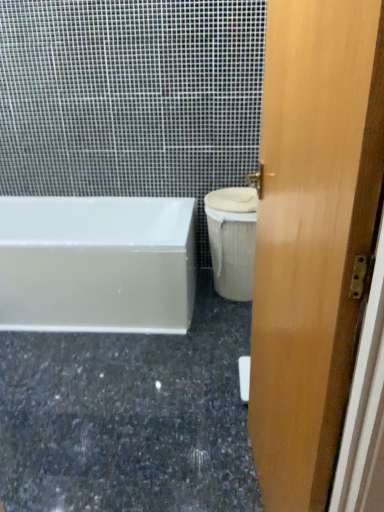
The height and width of the screenshot is (512, 384). Describe the element at coordinates (312, 234) in the screenshot. I see `light brown wood door at right` at that location.

What do you see at coordinates (232, 240) in the screenshot?
I see `white fabric-covered toilet bowl at right` at bounding box center [232, 240].

Image resolution: width=384 pixels, height=512 pixels. In order to click on light brown wood door at right in this screenshot , I will do `click(312, 234)`.

Considering the sizes of objects granite at lower left and white glossy bathtub at left in the image provided, who is wider, granite at lower left or white glossy bathtub at left?

granite at lower left.

Can you see granite at lower left touching white glossy bathtub at left?

No, granite at lower left is not beside white glossy bathtub at left.

Is granite at lower left inside or outside of white glossy bathtub at left?

granite at lower left is not enclosed by white glossy bathtub at left.

Which is closer to the camera, (x=10, y=419) or (x=116, y=320)?

Point (x=10, y=419) is positioned closer to the camera compared to point (x=116, y=320).

From a real-world perspective, is granite at lower left physically located above or below white fabric-covered toilet bowl at right?

granite at lower left is below white fabric-covered toilet bowl at right.

Is granite at lower left completely or partially outside of white fabric-covered toilet bowl at right?

Yes, granite at lower left is outside of white fabric-covered toilet bowl at right.

Does white glossy bathtub at left have a lesser height compared to light brown wood door at right?

Yes, white glossy bathtub at left is shorter than light brown wood door at right.

Is white glossy bathtub at left in front of light brown wood door at right?

That is False.

Looking at this image, considering the relative sizes of white glossy bathtub at left and light brown wood door at right in the image provided, is white glossy bathtub at left thinner than light brown wood door at right?

In fact, white glossy bathtub at left might be wider than light brown wood door at right.

What are the coordinates of `door on the right of white glossy bathtub at left` in the screenshot? It's located at (312, 234).

Where is `door below the white fabric-covered toilet bowl at right (from the image's perspective)`? The width and height of the screenshot is (384, 512). door below the white fabric-covered toilet bowl at right (from the image's perspective) is located at coordinates (312, 234).

In terms of size, does light brown wood door at right appear bigger or smaller than white fabric-covered toilet bowl at right?

In the image, light brown wood door at right appears to be larger than white fabric-covered toilet bowl at right.

Consider the image. Considering the positions of objects light brown wood door at right and white fabric-covered toilet bowl at right in the image provided, who is behind, light brown wood door at right or white fabric-covered toilet bowl at right?

white fabric-covered toilet bowl at right is behind.

Which is more to the right, light brown wood door at right or white fabric-covered toilet bowl at right?

light brown wood door at right.

At what (x,y) coordinates should I click in order to perform the action: click on bathtub behind the light brown wood door at right. Please return your answer as a coordinate pair (x, y). The height and width of the screenshot is (512, 384). Looking at the image, I should click on (97, 264).

Does light brown wood door at right have a greater width compared to white glossy bathtub at left?

No.

Is light brown wood door at right to the left or to the right of white glossy bathtub at left in the image?

Clearly, light brown wood door at right is on the right of white glossy bathtub at left in the image.

Which of these two, light brown wood door at right or white glossy bathtub at left, stands taller?

light brown wood door at right.

Is white fabric-covered toilet bowl at right wider or thinner than light brown wood door at right?

white fabric-covered toilet bowl at right is wider than light brown wood door at right.

Where is `door located below the white fabric-covered toilet bowl at right (from the image's perspective)`? door located below the white fabric-covered toilet bowl at right (from the image's perspective) is located at coordinates (312, 234).

From a real-world perspective, is white fabric-covered toilet bowl at right physically below light brown wood door at right?

Yes, from a real-world perspective, white fabric-covered toilet bowl at right is under light brown wood door at right.

Is white fabric-covered toilet bowl at right in contact with light brown wood door at right?

→ white fabric-covered toilet bowl at right and light brown wood door at right are clearly separated.

Does point (210, 201) lie behind point (48, 230)?

No, it is in front of (48, 230).

Considering the sizes of objects white fabric-covered toilet bowl at right and white glossy bathtub at left in the image provided, who is thinner, white fabric-covered toilet bowl at right or white glossy bathtub at left?

Thinner between the two is white fabric-covered toilet bowl at right.

Looking at this image, is white glossy bathtub at left at the back of white fabric-covered toilet bowl at right?

white fabric-covered toilet bowl at right is not turned away from white glossy bathtub at left.

From the image's perspective, is white fabric-covered toilet bowl at right located above or below white glossy bathtub at left?

Based on their image positions, white fabric-covered toilet bowl at right is located above white glossy bathtub at left.

Locate an element on the screen. granite below the white glossy bathtub at left (from a real-world perspective) is located at coordinates (129, 417).

The image size is (384, 512). Find the location of `granite on the left of white fabric-covered toilet bowl at right`. granite on the left of white fabric-covered toilet bowl at right is located at coordinates (129, 417).

From the image, which object appears to be nearer to granite at lower left, light brown wood door at right or white fabric-covered toilet bowl at right?

white fabric-covered toilet bowl at right lies closer to granite at lower left than the other object.

Looking at the image, which one is located further to white glossy bathtub at left, white fabric-covered toilet bowl at right or light brown wood door at right?

Among the two, light brown wood door at right is located further to white glossy bathtub at left.

Based on their spatial positions, is light brown wood door at right or granite at lower left further from white glossy bathtub at left?

light brown wood door at right lies further to white glossy bathtub at left than the other object.

When comparing their distances from granite at lower left, does light brown wood door at right or white glossy bathtub at left seem closer?

Based on the image, white glossy bathtub at left appears to be nearer to granite at lower left.

When comparing their distances from granite at lower left, does white glossy bathtub at left or light brown wood door at right seem closer?

white glossy bathtub at left.

From the picture: When comparing their distances from granite at lower left, does white fabric-covered toilet bowl at right or light brown wood door at right seem further?

light brown wood door at right.

Based on their spatial positions, is granite at lower left or white fabric-covered toilet bowl at right further from white glossy bathtub at left?

white fabric-covered toilet bowl at right is further to white glossy bathtub at left.

Considering their positions, is granite at lower left positioned closer to light brown wood door at right than white fabric-covered toilet bowl at right?

granite at lower left is positioned closer to the anchor light brown wood door at right.

Locate an element on the screen. This screenshot has height=512, width=384. granite positioned between light brown wood door at right and white fabric-covered toilet bowl at right from near to far is located at coordinates [129, 417].

The height and width of the screenshot is (512, 384). Identify the location of bathtub between granite at lower left and white fabric-covered toilet bowl at right in the front-back direction. (97, 264).

The width and height of the screenshot is (384, 512). I want to click on granite between light brown wood door at right and white glossy bathtub at left along the z-axis, so click(129, 417).

At what (x,y) coordinates should I click in order to perform the action: click on bathtub positioned between light brown wood door at right and white fabric-covered toilet bowl at right from near to far. Please return your answer as a coordinate pair (x, y). This screenshot has width=384, height=512. Looking at the image, I should click on (97, 264).